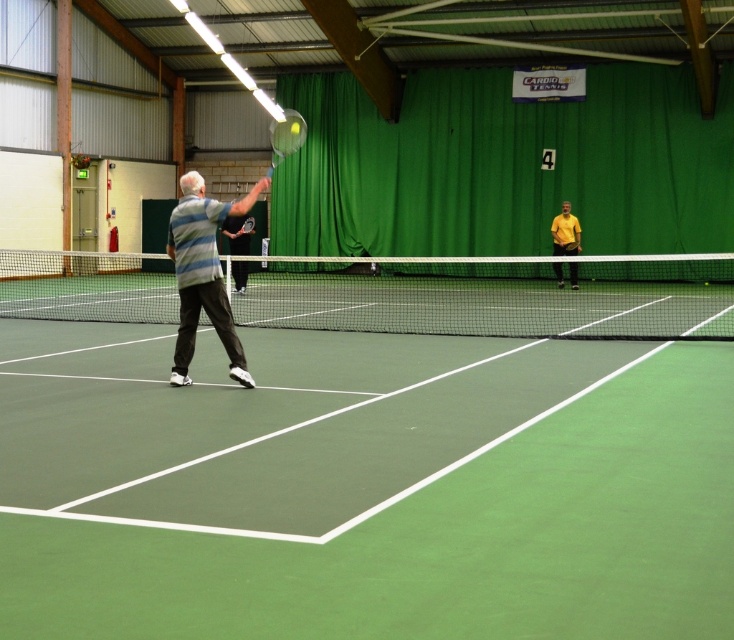
Question: Is green rubber tennis court at center positioned at the back of metallic silver tennis racket at upper center?

Choices:
 (A) yes
 (B) no

Answer: (B)

Question: Which is farther from the green rubber tennis court at center?

Choices:
 (A) metallic silver tennis racket at upper center
 (B) matte gray shirt at center

Answer: (B)

Question: From the image, what is the correct spatial relationship of green rubber tennis court at center in relation to white mesh net at center?

Choices:
 (A) left
 (B) right

Answer: (B)

Question: Is striped cotton shirt at center wider than yellow matte shirt at center?

Choices:
 (A) no
 (B) yes

Answer: (A)

Question: Which point is farther from the camera taking this photo?

Choices:
 (A) (517, 275)
 (B) (570, 236)
 (C) (269, 124)
 (D) (299, 580)

Answer: (C)

Question: Estimate the real-world distances between objects in this image. Which object is farther from the green rubber tennis court at center?

Choices:
 (A) white mesh net at center
 (B) yellow matte shirt at center
 (C) striped cotton shirt at center

Answer: (B)